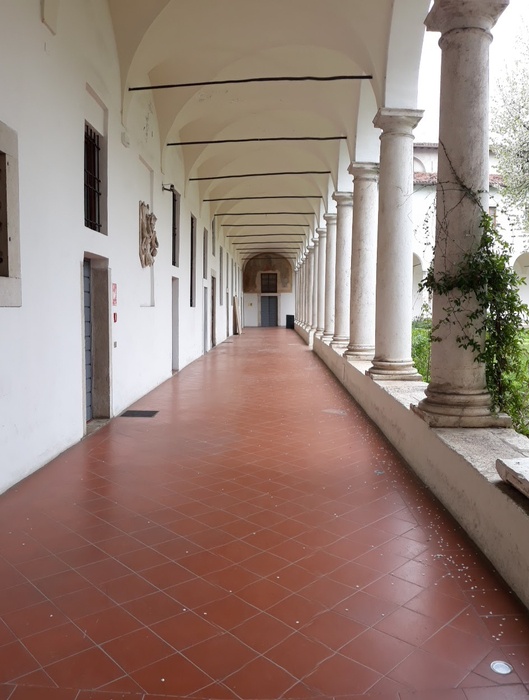
Identify the location of window. The width and height of the screenshot is (529, 700). (87, 204).